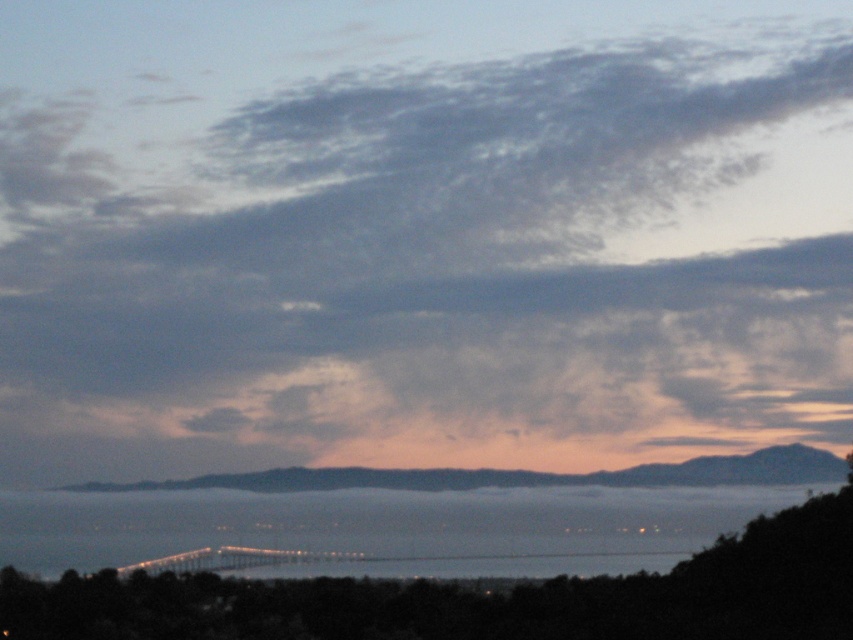
Question: Among these points, which one is farthest from the camera?

Choices:
 (A) (199, 506)
 (B) (207, 557)

Answer: (B)

Question: Is blue water at center positioned in front of metallic gray bridge at center?

Choices:
 (A) no
 (B) yes

Answer: (B)

Question: Can you confirm if blue water at center is positioned to the right of metallic gray bridge at center?

Choices:
 (A) yes
 (B) no

Answer: (A)

Question: Which of the following is the closest to the observer?

Choices:
 (A) blue water at center
 (B) metallic gray bridge at center

Answer: (A)

Question: Does blue water at center have a lesser width compared to metallic gray bridge at center?

Choices:
 (A) yes
 (B) no

Answer: (B)

Question: Which object is farther from the camera taking this photo?

Choices:
 (A) metallic gray bridge at center
 (B) blue water at center

Answer: (A)